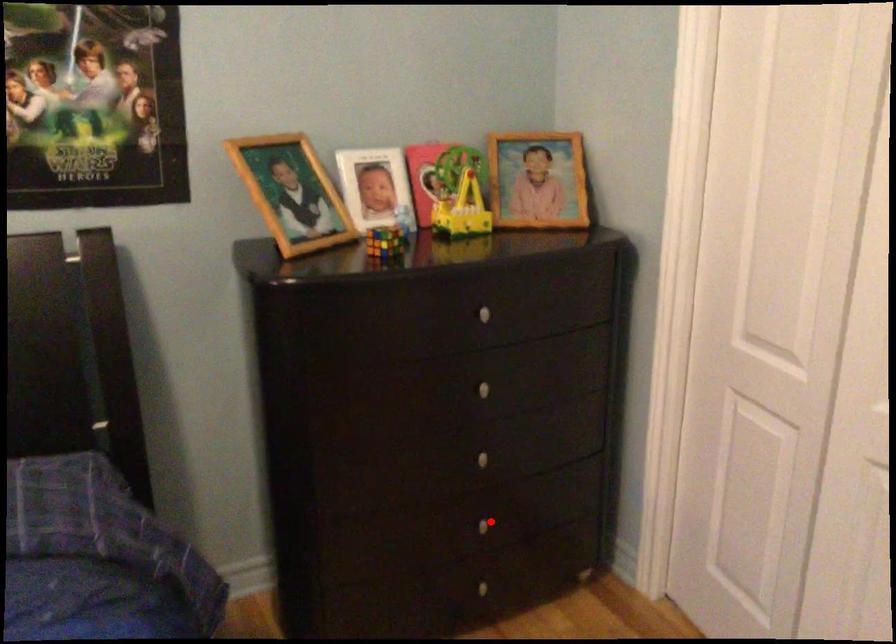
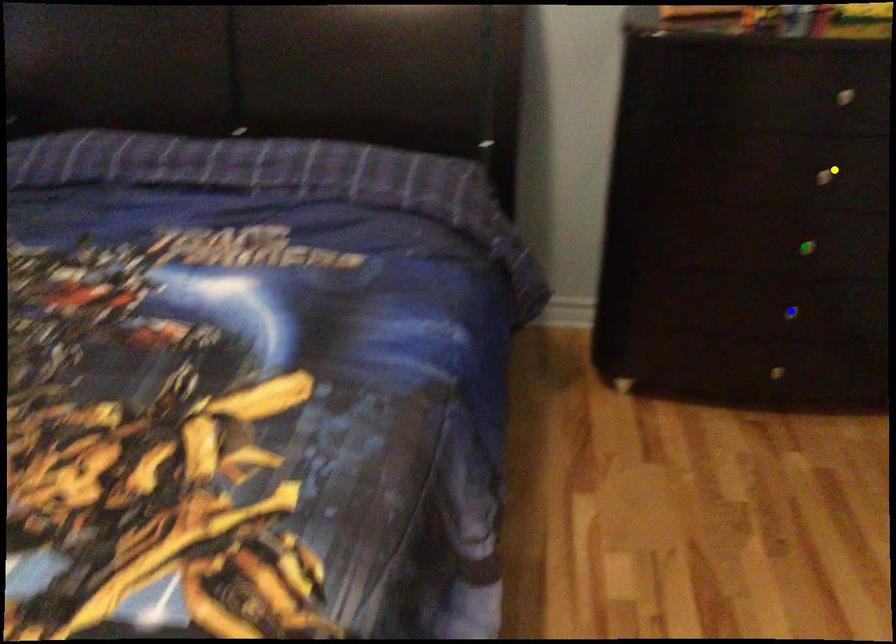
Question: I am providing you with two images of the same scene from different viewpoints. A red point is marked on the first image. You are given multiple points on the second image. Which spot in image 2 lines up with the point in image 1?

Choices:
 (A) blue point
 (B) yellow point
 (C) green point

Answer: (A)